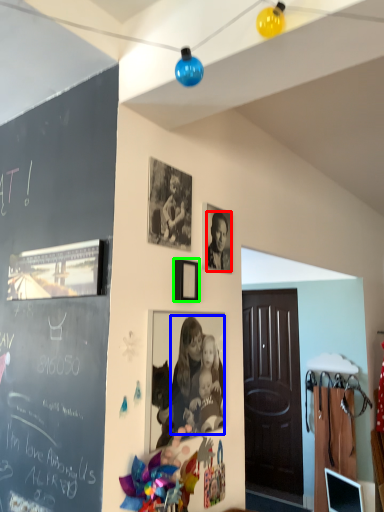
Question: Estimate the real-world distances between objects in this image. Which object is farther from person (highlighted by a red box), person (highlighted by a blue box) or picture frame (highlighted by a green box)?

Choices:
 (A) person
 (B) picture frame

Answer: (A)